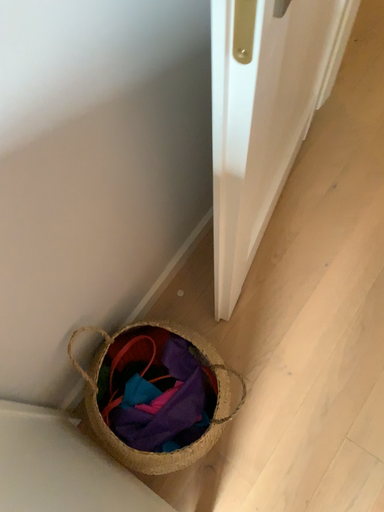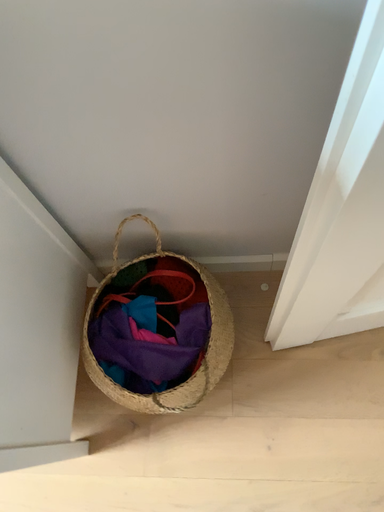
Question: How did the camera likely rotate when shooting the video?

Choices:
 (A) rotated right
 (B) rotated left

Answer: (B)